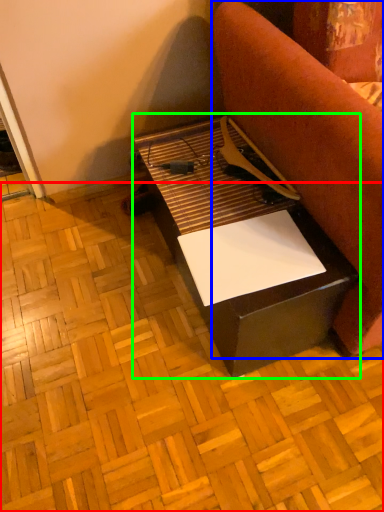
Question: Which is farther away from plywood (highlighted by a red box)? furniture (highlighted by a blue box) or table (highlighted by a green box)?

Choices:
 (A) furniture
 (B) table

Answer: (A)